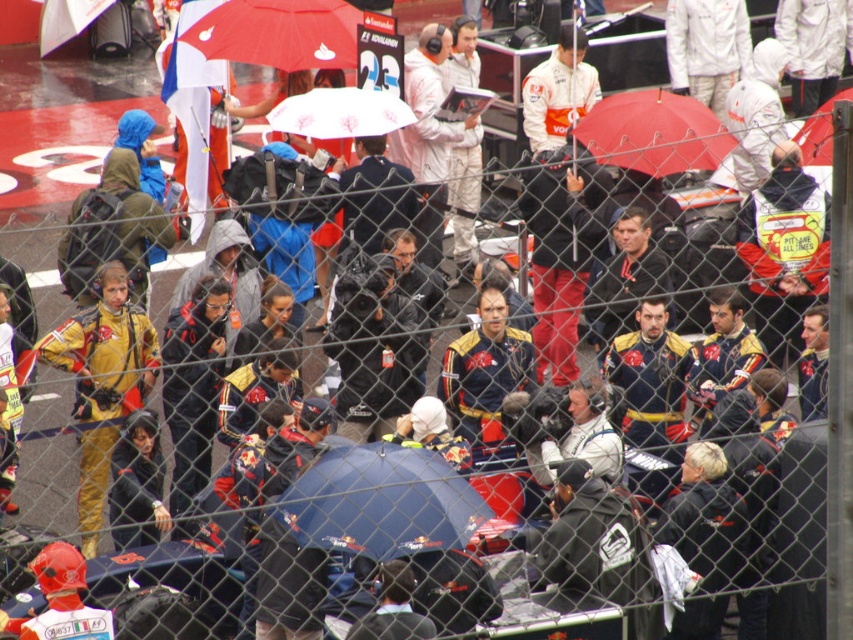
You are a photographer standing at the edge of the motorsport event area. You want to take a photo that includes both the matte blue jacket at center and the white matte jacket at center. Which jacket will appear larger in your photo?

The matte blue jacket at center will appear larger in the photo because it is closer to the viewer than the white matte jacket at center.

Consider the image. You are a photographer positioned at the edge of the motorsport event area. You need to capture a photo that includes both the red matte umbrella at upper center and the white matte jacket at center. Based on their heights, will the umbrella block the view of the jacket in the photo?

The red matte umbrella at upper center has a lesser height compared to the white matte jacket at center, so the umbrella will not block the view of the jacket in the photo.

You are standing at the motorsport event and want to move from the point closer to you to the point further away. Which path should you take between the two points, point (512, 330) and point (538, 145)?

The point closer to the viewer is point (512, 330), so you should move from point (512, 330) to point (538, 145) to reach the further point.